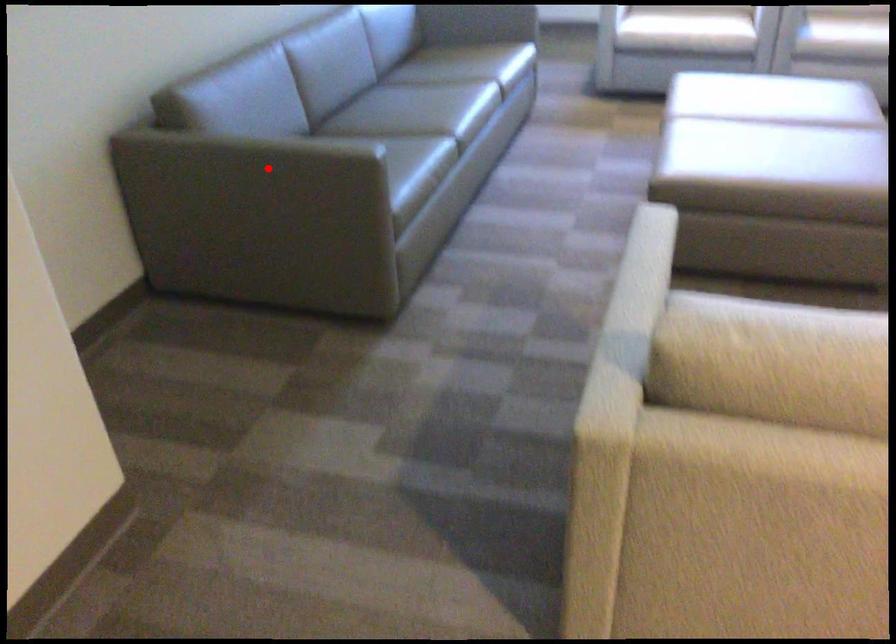
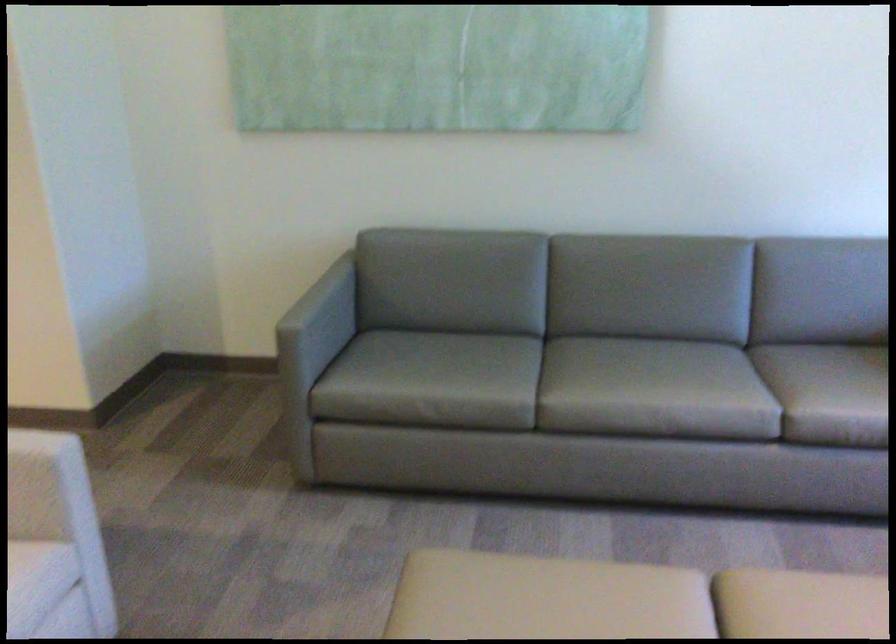
Find the pixel in the second image that matches the highlighted location in the first image.

(321, 313)